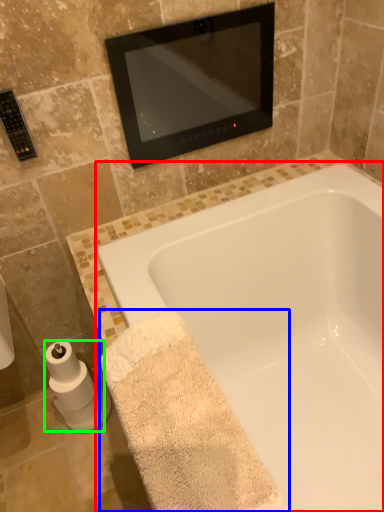
Question: Based on their relative distances, which object is farther from bathtub (highlighted by a red box)? Choose from bath towel (highlighted by a blue box) and toilet paper (highlighted by a green box).

Choices:
 (A) bath towel
 (B) toilet paper

Answer: (B)